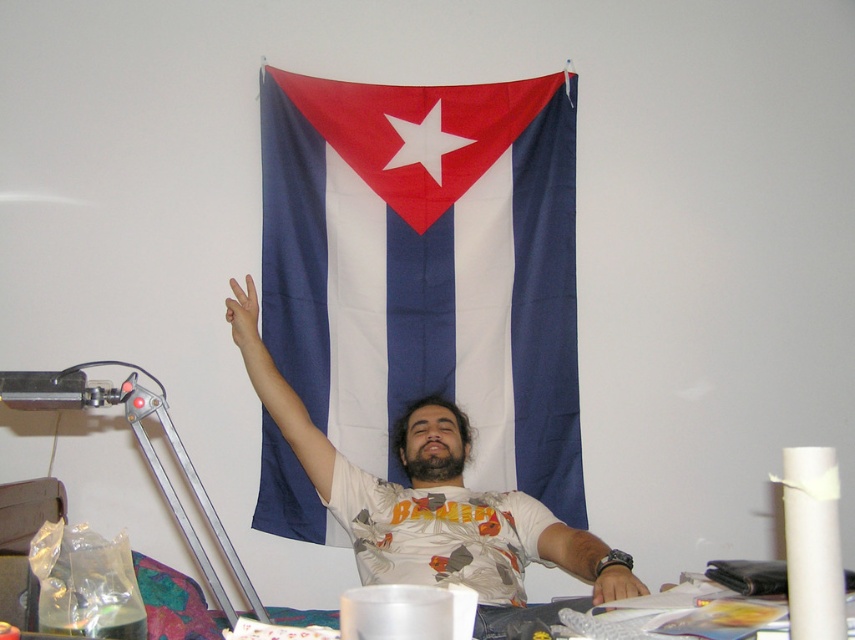
Does matte skin hand at upper center appear on the left side of matte white wristwatch at center?

Correct, you'll find matte skin hand at upper center to the left of matte white wristwatch at center.

Who is higher up, matte skin hand at upper center or matte white wristwatch at center?

Positioned higher is matte skin hand at upper center.

Is point (225, 317) farther from viewer compared to point (624, 579)?

Yes.

This screenshot has height=640, width=855. Identify the location of matte skin hand at upper center. (243, 317).

Is blue fabric flag at center wider than white matte arm at upper center?

Yes.

Between blue fabric flag at center and white matte arm at upper center, which one appears on the right side from the viewer's perspective?

blue fabric flag at center

Which is behind, point (502, 102) or point (278, 420)?

Point (502, 102)

Where is `blue fabric flag at center`? Image resolution: width=855 pixels, height=640 pixels. blue fabric flag at center is located at coordinates (428, 266).

Between point (234, 317) and point (610, 600), which one is positioned in front?

Positioned in front is point (610, 600).

Between white matte arm at upper center and matte white wristwatch at center, which one is positioned higher?

white matte arm at upper center

Who is more distant from viewer, (251, 360) or (606, 568)?

The point (251, 360) is more distant.

Image resolution: width=855 pixels, height=640 pixels. I want to click on white matte arm at upper center, so click(278, 392).